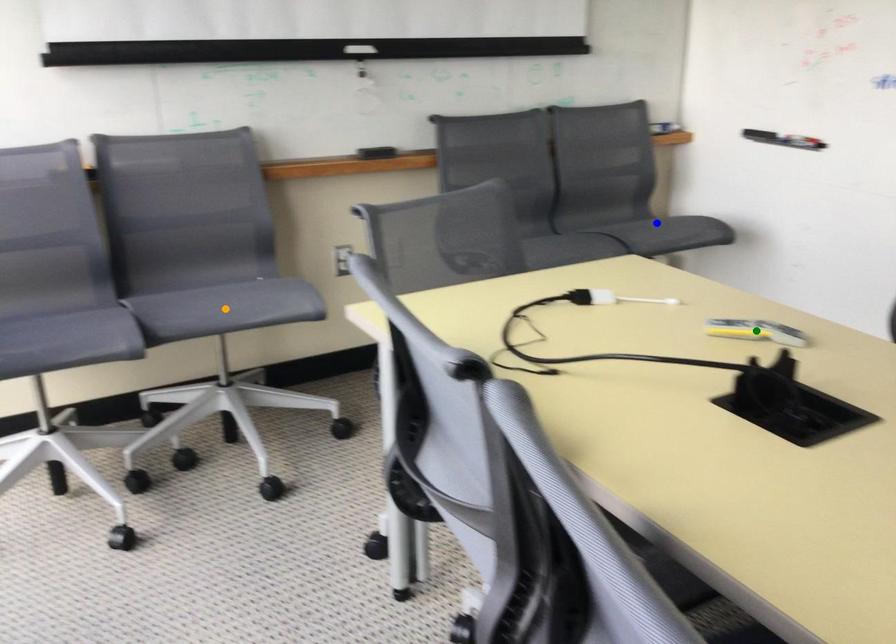
Order these from nearest to farthest:
1. green point
2. blue point
3. orange point

green point → orange point → blue point